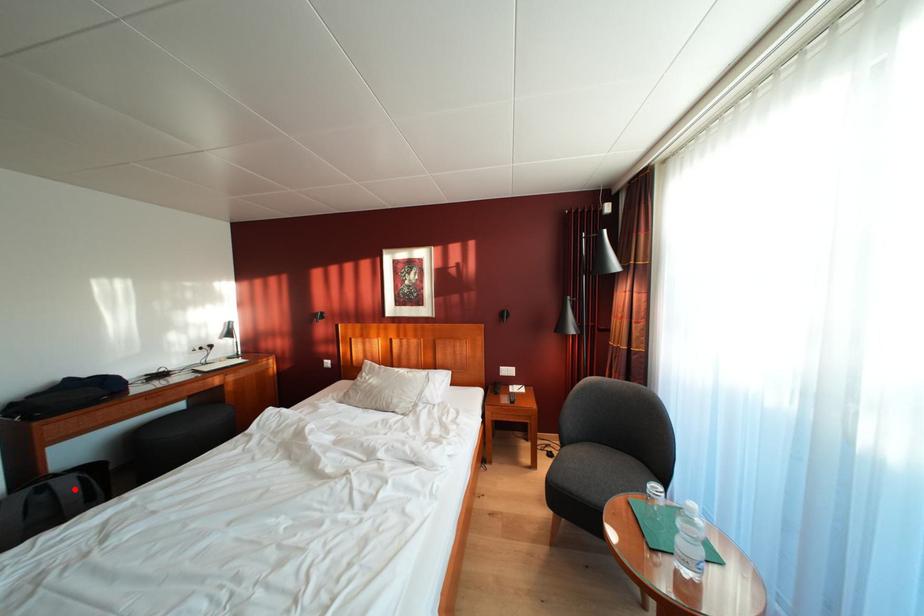
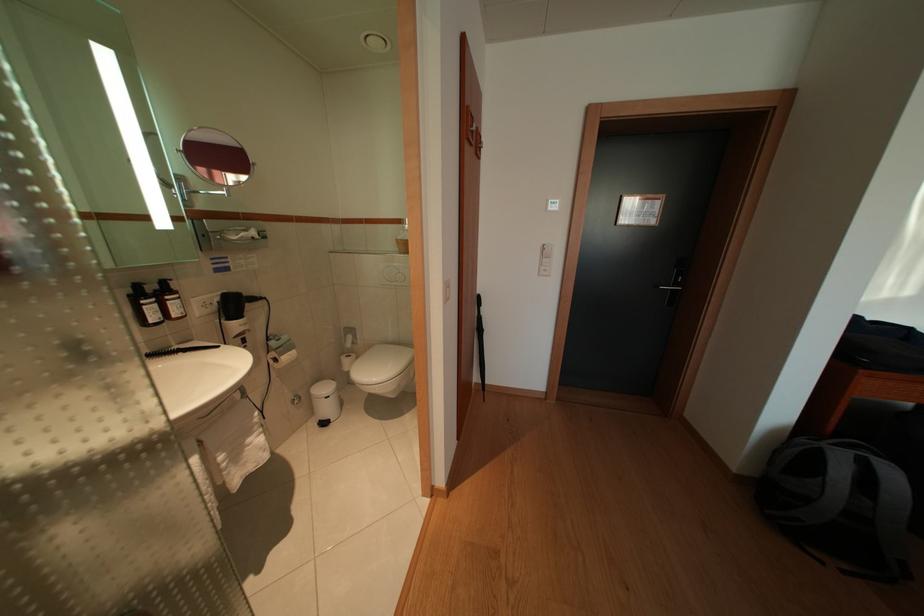
In the second image, find the point that corresponds to the highlighted location in the first image.

(901, 480)